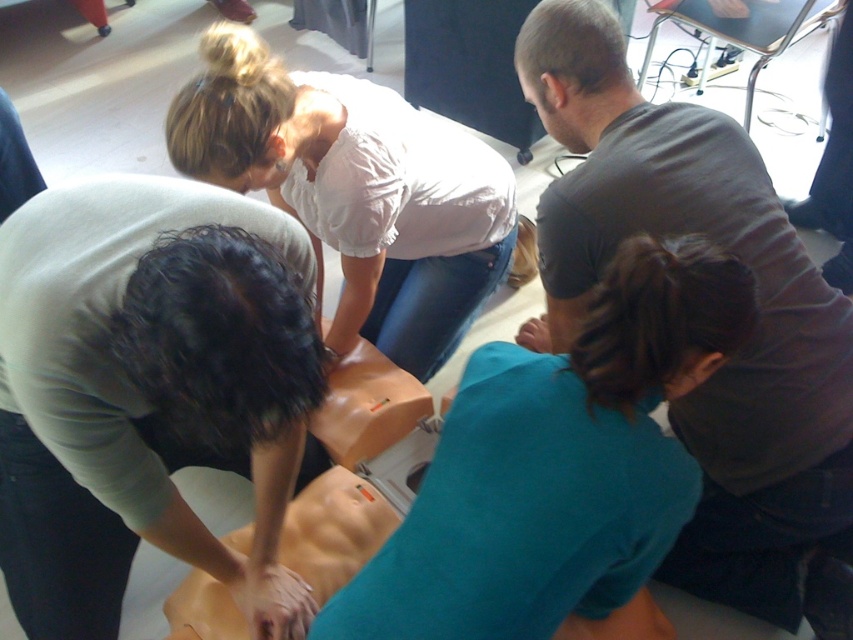
You are a first responder attending a CPR training session. You see two participants wearing a matte green shirt at center and a white cotton shirt at upper center. Which participant is closer to the mannequin?

The matte green shirt at center is positioned under the white cotton shirt at upper center, meaning it is closer to the mannequin.